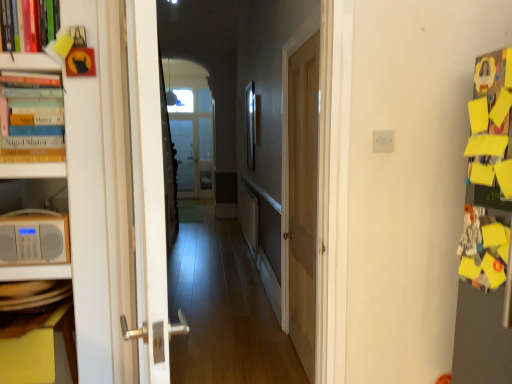
Question: Based on their sizes in the image, would you say wooden floor at center is bigger or smaller than wooden door at center, marked as the 2th door in a front-to-back arrangement?

Choices:
 (A) small
 (B) big

Answer: (A)

Question: Considering their positions, is wooden floor at center located in front of or behind wooden door at center, positioned as the first door in right-to-left order?

Choices:
 (A) front
 (B) behind

Answer: (A)

Question: Estimate the real-world distances between objects in this image. Which object is closer to the wooden floor at center?

Choices:
 (A) wooden door at center, marked as the first door in a back-to-front arrangement
 (B) matte white radio at left
 (C) metallic silver picture frame at center
 (D) white plastic electric outlet at center
 (E) hardcover books at left

Answer: (C)

Question: Which is nearer to the matte white radio at left?

Choices:
 (A) hardcover books at left
 (B) white glossy door at left, placed as the 2th door when sorted from back to front
 (C) wooden floor at center
 (D) wooden door at center, marked as the first door in a back-to-front arrangement
 (E) metallic silver picture frame at center

Answer: (A)